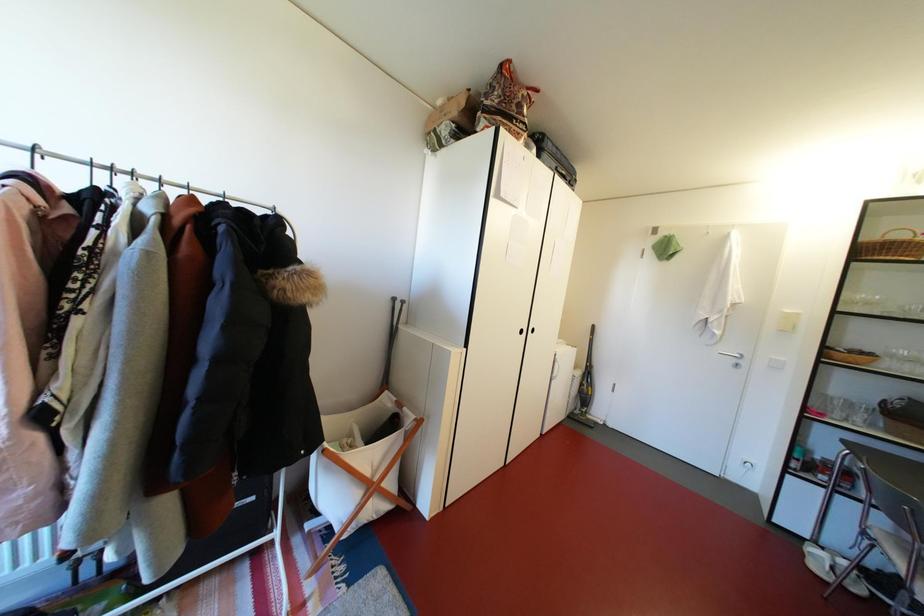
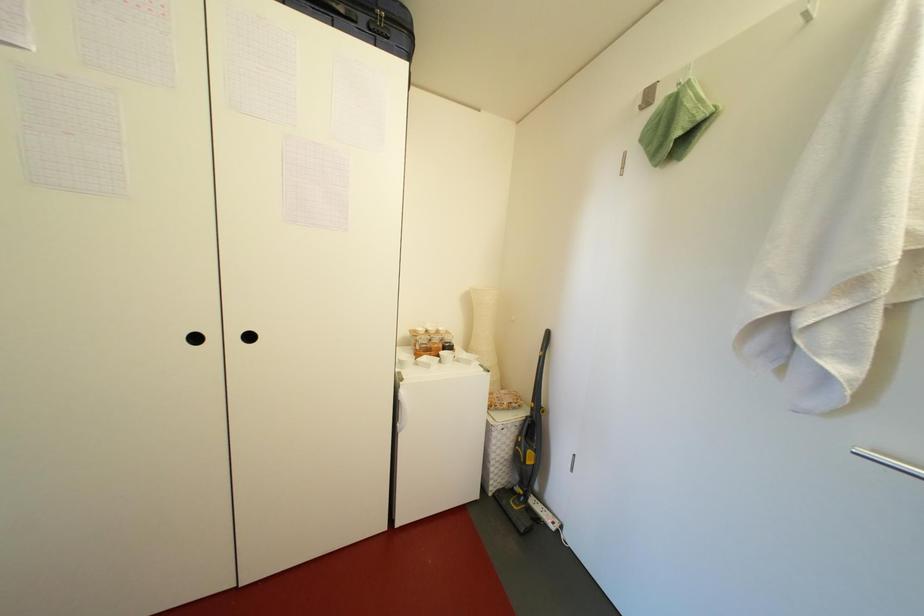
The images are taken continuously from a first-person perspective. In which direction are you moving?

The cameraman moved toward right, forward.